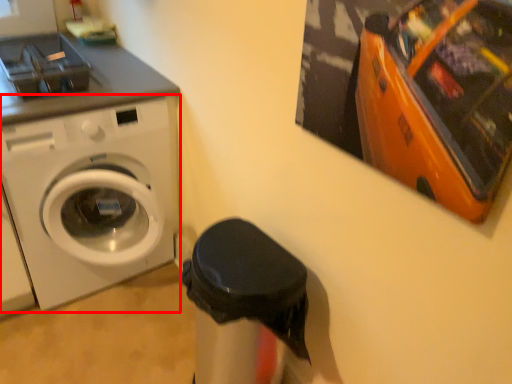
Question: From the image's perspective, what is the correct spatial positioning of washing machine (annotated by the red box) in reference to garbage?

Choices:
 (A) above
 (B) below

Answer: (A)